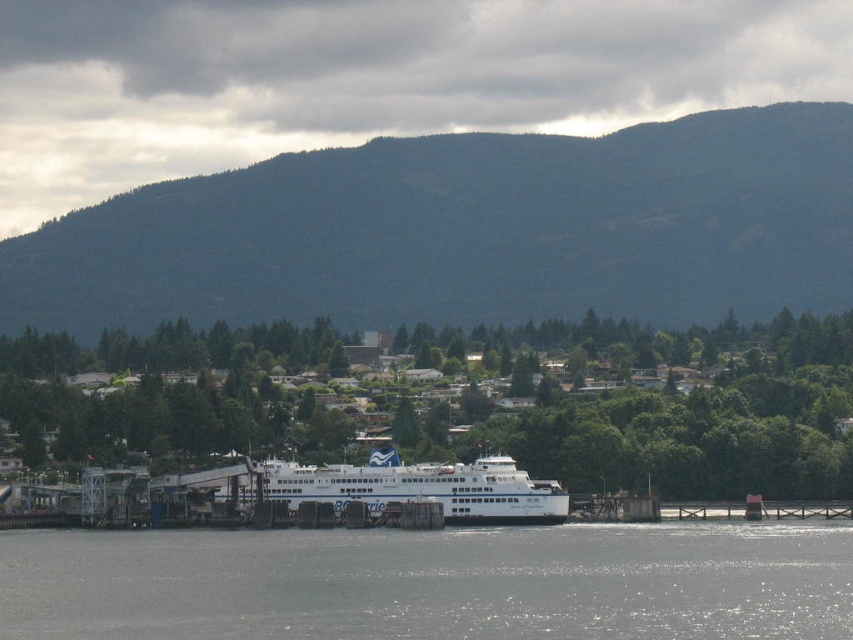
Question: Which object is positioned closest to the green forested mountain at upper center?

Choices:
 (A) white glossy ferry at center
 (B) clear water at lower center
 (C) green leafy tree at center

Answer: (C)

Question: Is clear water at lower center below white glossy ferry at center?

Choices:
 (A) no
 (B) yes

Answer: (B)

Question: Is green forested mountain at upper center bigger than white glossy ferry at center?

Choices:
 (A) yes
 (B) no

Answer: (A)

Question: In this image, where is green forested mountain at upper center located relative to green leafy tree at center?

Choices:
 (A) above
 (B) below

Answer: (A)

Question: Which point appears farthest from the camera in this image?

Choices:
 (A) (74, 253)
 (B) (628, 404)
 (C) (769, 564)
 (D) (511, 472)

Answer: (A)

Question: Estimate the real-world distances between objects in this image. Which object is closer to the clear water at lower center?

Choices:
 (A) white glossy ferry at center
 (B) green leafy tree at center

Answer: (A)